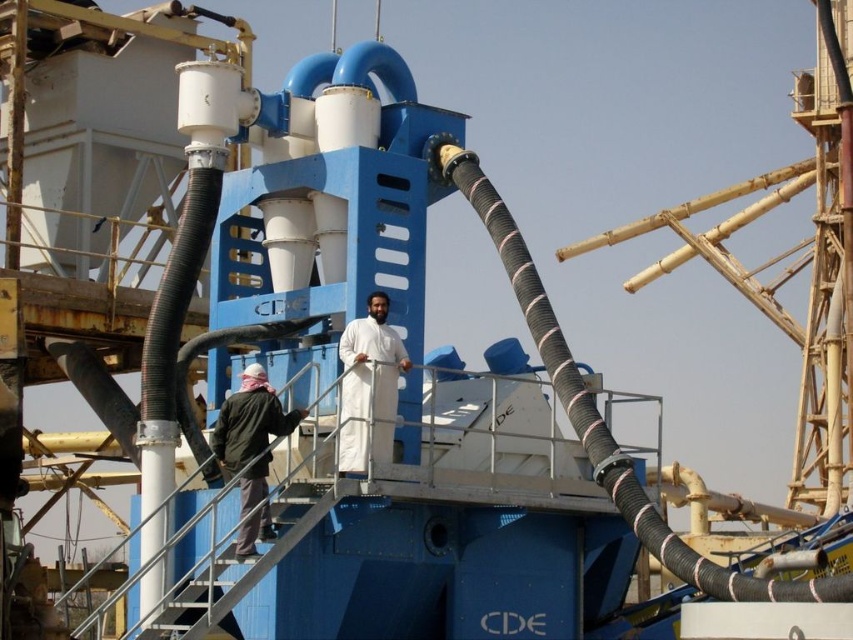
You are an observer in the industrial area and see the white matte clothing at center and the dark green jacket at lower left. Which person is standing to the right of the other?

The white matte clothing at center is positioned on the right side of dark green jacket at lower left, so the person in white matte clothing at center is to the right of the person in dark green jacket at lower left.

You are an inspector tasked with assessing safety gear compliance in the industrial area. You see the white matte clothing at center and the dark green jacket at lower left. Which worker is wearing clothing that might not meet the minimum size requirements for visibility? Please explain based on their sizes.

The dark green jacket at lower left might not meet the minimum size requirements for visibility because it is smaller in size compared to the white matte clothing at center, which could make it harder to spot from a distance.

You are an inspector at the construction site and need to locate the dark green jacket at lower left and the white matte clothing at center. Which of the two is closer to the entrance of the CDE machine?

The dark green jacket at lower left is behind the white matte clothing at center, so the white matte clothing at center is closer to the entrance of the CDE machine.